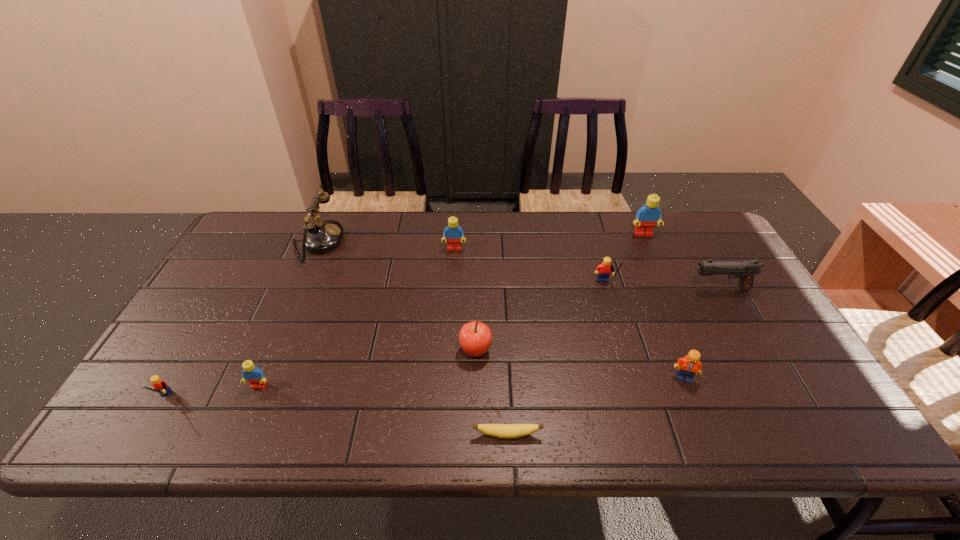
Find the location of a particular element. Lego that is at the near edge is located at coordinates (161, 386).

The height and width of the screenshot is (540, 960). Identify the location of banana located in the near edge section of the desktop. (505, 431).

The height and width of the screenshot is (540, 960). In order to click on object situated at the left edge in this screenshot , I will do `click(161, 386)`.

Identify the location of object positioned at the right edge. coord(744,270).

Find the location of a particular element. object located in the near left corner section of the desktop is located at coordinates pos(161,386).

Find the location of a particular element. This screenshot has width=960, height=540. vacant area at the far edge of the desktop is located at coordinates (485, 242).

The height and width of the screenshot is (540, 960). In order to click on blank space at the left edge in this screenshot , I will do `click(174, 373)`.

The image size is (960, 540). I want to click on free region at the far right corner, so click(697, 246).

At what (x,y) coordinates should I click in order to perform the action: click on free space between the tallest Lego and the leftmost Lego. Please return your answer as a coordinate pair (x, y). The width and height of the screenshot is (960, 540). Looking at the image, I should click on (403, 317).

Find the location of `free area in between the pink apple and the biggest blue Lego`. free area in between the pink apple and the biggest blue Lego is located at coordinates (560, 293).